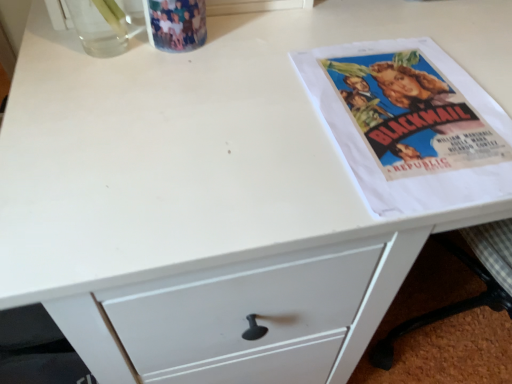
Describe the element at coordinates (411, 124) in the screenshot. The height and width of the screenshot is (384, 512). I see `white paper at upper right` at that location.

In order to click on white paper at upper right in this screenshot , I will do `click(411, 124)`.

Where is `white paper at upper right`? white paper at upper right is located at coordinates (411, 124).